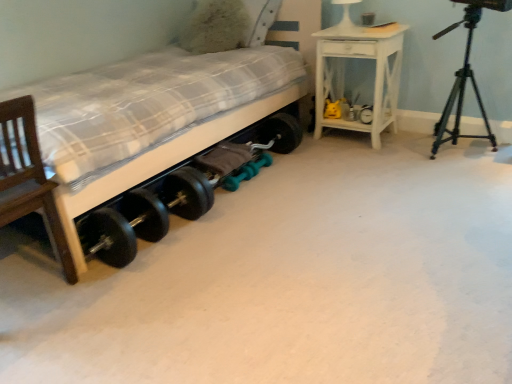
Question: Is white glossy table lamp at upper center taller than wooden bed at lower left?

Choices:
 (A) no
 (B) yes

Answer: (A)

Question: Can you confirm if white glossy table lamp at upper center is positioned to the left of wooden bed at lower left?

Choices:
 (A) no
 (B) yes

Answer: (A)

Question: From a real-world perspective, is white glossy table lamp at upper center positioned over wooden bed at lower left based on gravity?

Choices:
 (A) no
 (B) yes

Answer: (B)

Question: Would you say white glossy table lamp at upper center is a long distance from wooden bed at lower left?

Choices:
 (A) yes
 (B) no

Answer: (A)

Question: From the image's perspective, is white glossy table lamp at upper center located above wooden bed at lower left?

Choices:
 (A) no
 (B) yes

Answer: (B)

Question: Considering the relative positions of white glossy table lamp at upper center and wooden bed at lower left in the image provided, is white glossy table lamp at upper center to the right of wooden bed at lower left from the viewer's perspective?

Choices:
 (A) no
 (B) yes

Answer: (B)

Question: From a real-world perspective, is wooden bed at lower left positioned over white glossy table lamp at upper center based on gravity?

Choices:
 (A) no
 (B) yes

Answer: (A)

Question: Is wooden bed at lower left turned away from white glossy table lamp at upper center?

Choices:
 (A) no
 (B) yes

Answer: (A)

Question: Can you confirm if wooden bed at lower left is taller than white glossy table lamp at upper center?

Choices:
 (A) yes
 (B) no

Answer: (A)

Question: Is wooden bed at lower left outside of white glossy table lamp at upper center?

Choices:
 (A) no
 (B) yes

Answer: (B)

Question: Is wooden bed at lower left smaller than white glossy table lamp at upper center?

Choices:
 (A) yes
 (B) no

Answer: (B)

Question: From a real-world perspective, is wooden bed at lower left positioned under white glossy table lamp at upper center based on gravity?

Choices:
 (A) yes
 (B) no

Answer: (A)

Question: Is fluffy white pillow at upper center smaller than white painted wood nightstand at upper right?

Choices:
 (A) yes
 (B) no

Answer: (A)